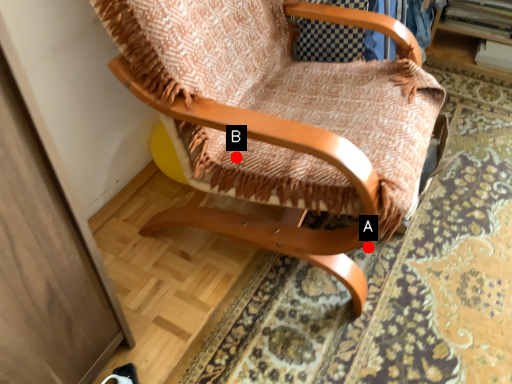
Question: Two points are circled on the image, labeled by A and B beside each circle. Which of the following is the closest to the observer?

Choices:
 (A) A is closer
 (B) B is closer

Answer: (B)